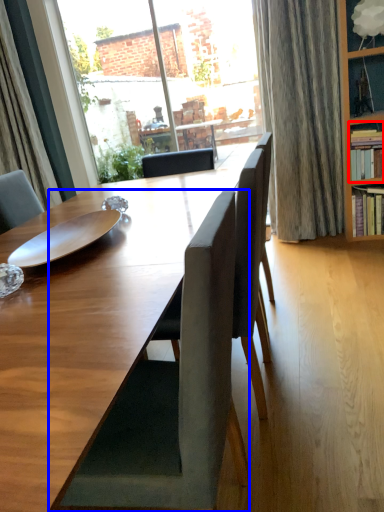
Question: Which object is further to the camera taking this photo, shelf (highlighted by a red box) or chair (highlighted by a blue box)?

Choices:
 (A) shelf
 (B) chair

Answer: (A)